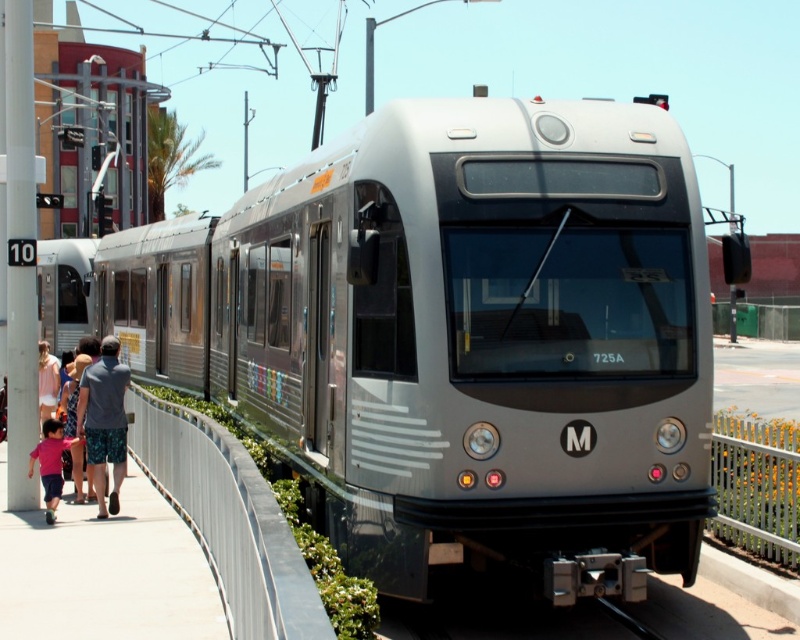
You are standing on the platform at the light rail station. There is a specific point marked at coordinates point (110, 380) that you need to reach. If you start moving directly towards it from your current position, how far will you have to walk to reach that point?

The distance between you and the point (110, 380) is 8.73 meters, so you will have to walk 8.73 meters to reach it.

You are standing on the platform and see the satin silver train at center and the gray cotton shorts at lower left. Which object is nearer to you?

The satin silver train at center is closer to you than the gray cotton shorts at lower left.

From the picture: You are standing on the platform of the light rail station and want to walk from point (114, 356) to point (52, 500). Which direction should you move to get closer to your destination?

You should move towards the lower right direction because point (52, 500) is closer to the viewer than point (114, 356).